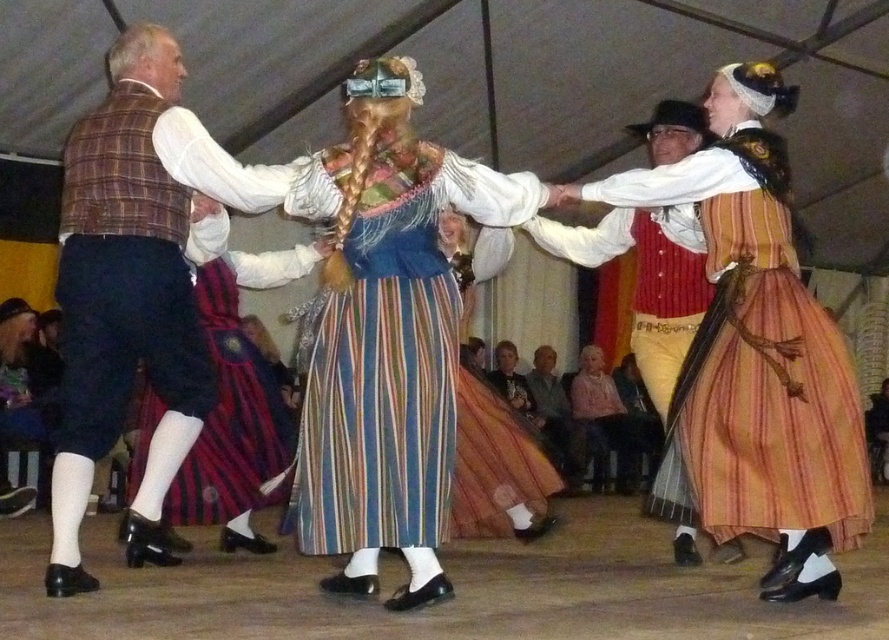
Which is above, striped cotton dress at center or light brown leather jacket at center?

striped cotton dress at center is higher up.

The image size is (889, 640). I want to click on striped cotton dress at center, so click(758, 349).

What do you see at coordinates (758, 349) in the screenshot? I see `striped cotton dress at center` at bounding box center [758, 349].

Does striped cotton dress at center have a greater height compared to striped wool skirt at center?

Yes, striped cotton dress at center is taller than striped wool skirt at center.

What are the coordinates of `striped cotton dress at center` in the screenshot? It's located at (758, 349).

Does striped fabric dress at center appear on the right side of striped wool skirt at center?

Correct, you'll find striped fabric dress at center to the right of striped wool skirt at center.

Which is more to the right, striped fabric dress at center or striped wool skirt at center?

striped fabric dress at center

Which is behind, point (327, 259) or point (234, 282)?

The point (234, 282) is more distant.

At what (x,y) coordinates should I click in order to perform the action: click on striped fabric dress at center. Please return your answer as a coordinate pair (x, y). The image size is (889, 640). Looking at the image, I should click on (387, 336).